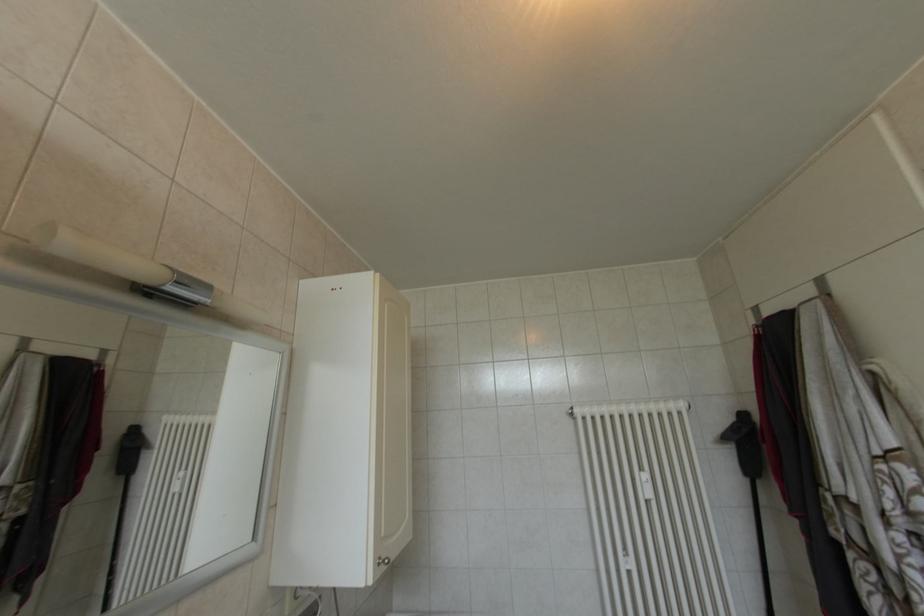
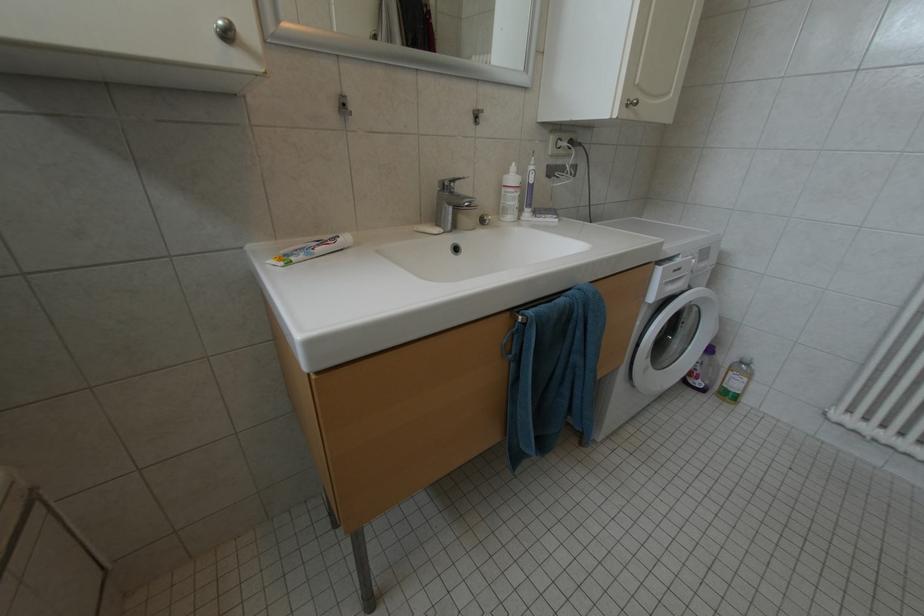
Looking at this image, based on the continuous images, in which direction is the camera rotating?

The camera rotated toward left-down.